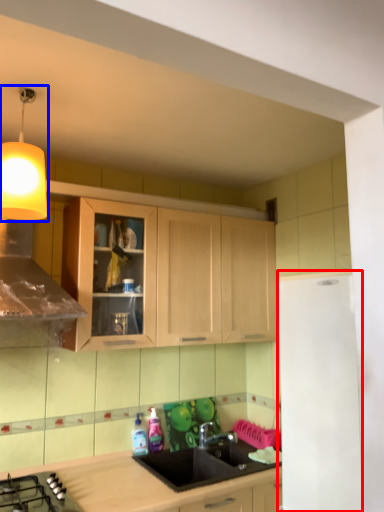
Question: Which object is closer to the camera taking this photo, appliance (highlighted by a red box) or light fixture (highlighted by a blue box)?

Choices:
 (A) appliance
 (B) light fixture

Answer: (A)